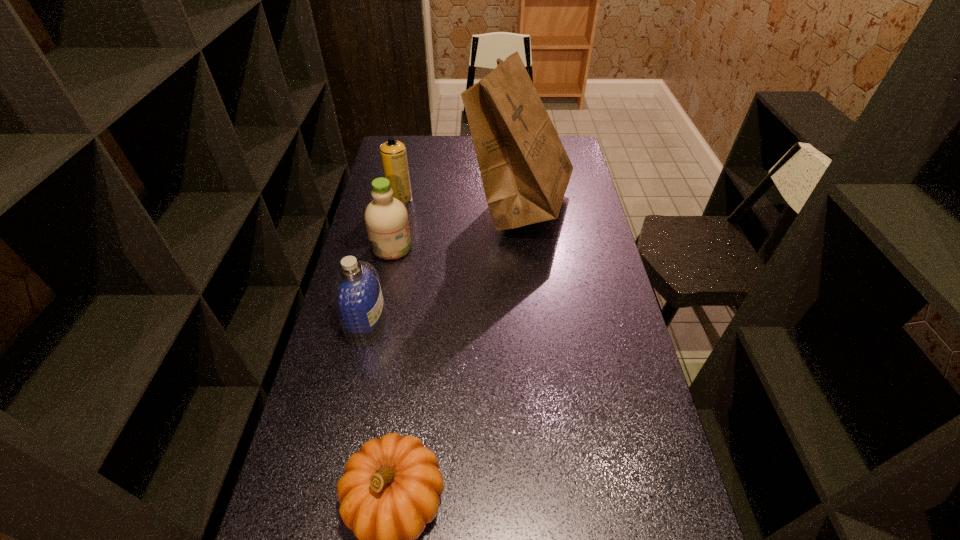
Find the location of a particular element. The height and width of the screenshot is (540, 960). object that is at the right edge is located at coordinates (525, 170).

The image size is (960, 540). In the image, there is a desktop. Find the location of `vacant space at the left edge`. vacant space at the left edge is located at coordinates (322, 407).

Where is `free space at the right edge of the desktop`? The width and height of the screenshot is (960, 540). free space at the right edge of the desktop is located at coordinates (584, 289).

Locate an element on the screen. Image resolution: width=960 pixels, height=540 pixels. vacant area that lies between the nearer cleansing agent and the grocery bag is located at coordinates (444, 264).

This screenshot has height=540, width=960. Find the location of `vacant point located between the nearer cleansing agent and the aerosol can`. vacant point located between the nearer cleansing agent and the aerosol can is located at coordinates (383, 261).

You are a GUI agent. You are given a task and a screenshot of the screen. Output one action in this format:
    pyautogui.click(x=<x>, y=<y>)
    Task: Click on the unoccupied area between the aerosol can and the nearer cleansing agent
    Image resolution: width=960 pixels, height=540 pixels.
    Given the screenshot: What is the action you would take?
    click(383, 261)

Where is `free spot between the tallest object and the aerosol can`? free spot between the tallest object and the aerosol can is located at coordinates coord(460,201).

Locate an element on the screen. Image resolution: width=960 pixels, height=540 pixels. vacant space in between the rightmost object and the aerosol can is located at coordinates (460, 201).

Select which object is the third closest to the nearer cleansing agent. Please provide its 2D coordinates. Your answer should be formatted as a tuple, i.e. [(x, y)], where the tuple contains the x and y coordinates of a point satisfying the conditions above.

[(525, 170)]

Choose which object is the fourth nearest neighbor to the farther cleansing agent. Please provide its 2D coordinates. Your answer should be formatted as a tuple, i.e. [(x, y)], where the tuple contains the x and y coordinates of a point satisfying the conditions above.

[(390, 490)]